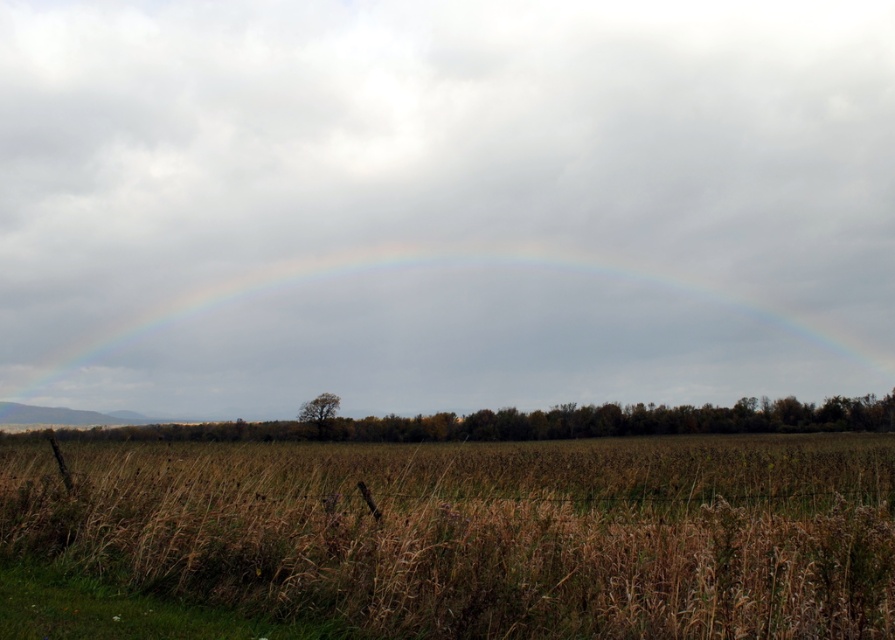
Can you confirm if brown grass at lower center is bigger than rainbow at center?

No.

Is brown grass at lower center positioned in front of rainbow at center?

Yes, it is.

Is point (450, 618) more distant than point (560, 317)?

No, (450, 618) is in front of (560, 317).

Locate an element on the screen. Image resolution: width=895 pixels, height=640 pixels. brown grass at lower center is located at coordinates (486, 532).